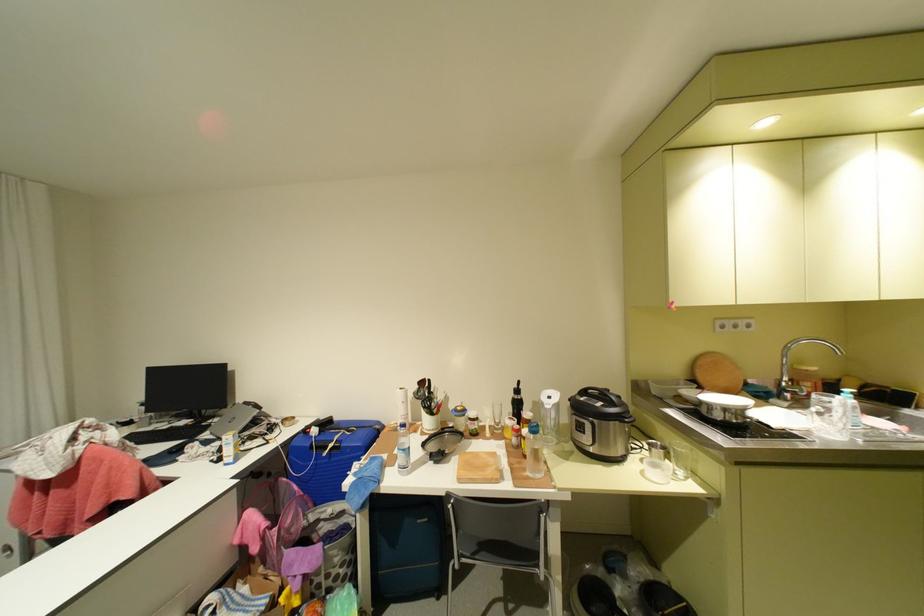
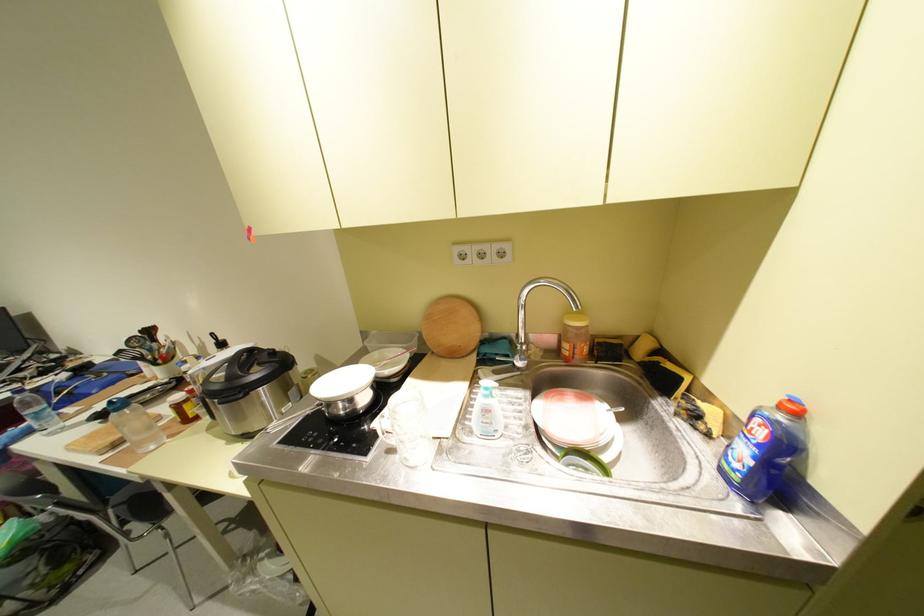
Question: What movement of the cameraman would produce the second image?

Choices:
 (A) Left
 (B) Right
 (C) Forward
 (D) Backward

Answer: (B)